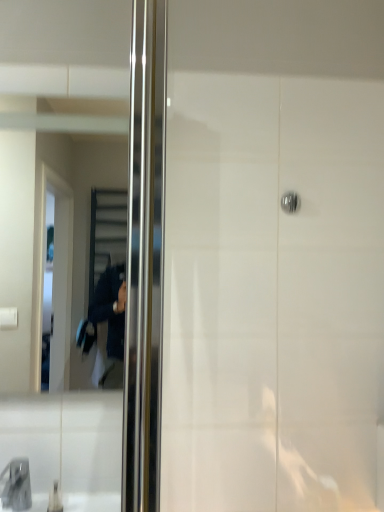
Question: Does matte gray faucet at lower left have a larger size compared to metallic reflective mirror at left?

Choices:
 (A) yes
 (B) no

Answer: (B)

Question: Can you confirm if matte gray faucet at lower left is wider than metallic reflective mirror at left?

Choices:
 (A) yes
 (B) no

Answer: (A)

Question: Is matte gray faucet at lower left shorter than metallic reflective mirror at left?

Choices:
 (A) yes
 (B) no

Answer: (A)

Question: From the image's perspective, is matte gray faucet at lower left beneath metallic reflective mirror at left?

Choices:
 (A) yes
 (B) no

Answer: (A)

Question: Would you say matte gray faucet at lower left is outside metallic reflective mirror at left?

Choices:
 (A) yes
 (B) no

Answer: (A)

Question: In terms of width, does satin chrome door handle at upper center look wider or thinner when compared to metallic reflective mirror at left?

Choices:
 (A) wide
 (B) thin

Answer: (B)

Question: Is satin chrome door handle at upper center taller or shorter than metallic reflective mirror at left?

Choices:
 (A) short
 (B) tall

Answer: (A)

Question: Choose the correct answer: Is satin chrome door handle at upper center inside metallic reflective mirror at left or outside it?

Choices:
 (A) outside
 (B) inside

Answer: (A)

Question: Based on their positions, is satin chrome door handle at upper center located to the left or right of metallic reflective mirror at left?

Choices:
 (A) left
 (B) right

Answer: (B)

Question: In the image, is matte gray faucet at lower left positioned in front of or behind metallic reflective mirror at left?

Choices:
 (A) behind
 (B) front

Answer: (B)

Question: Considering the positions of matte gray faucet at lower left and metallic reflective mirror at left in the image, is matte gray faucet at lower left taller or shorter than metallic reflective mirror at left?

Choices:
 (A) short
 (B) tall

Answer: (A)

Question: Is matte gray faucet at lower left bigger or smaller than metallic reflective mirror at left?

Choices:
 (A) small
 (B) big

Answer: (A)

Question: Is matte gray faucet at lower left situated inside metallic reflective mirror at left or outside?

Choices:
 (A) inside
 (B) outside

Answer: (B)

Question: Is point (61, 165) closer or farther from the camera than point (296, 199)?

Choices:
 (A) farther
 (B) closer

Answer: (B)

Question: Looking at their shapes, would you say metallic reflective mirror at left is wider or thinner than satin chrome door handle at upper center?

Choices:
 (A) thin
 (B) wide

Answer: (B)